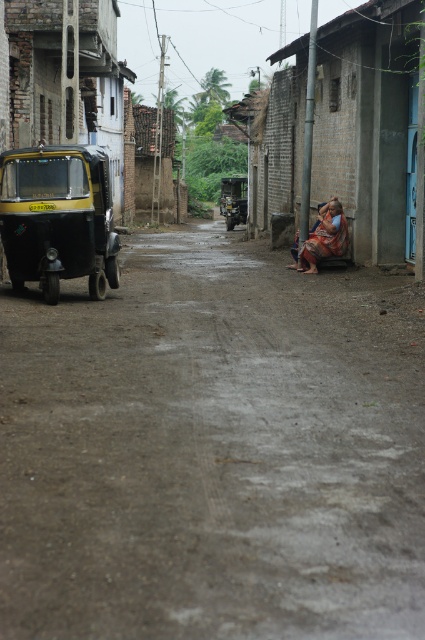
Question: Is yellow matte auto-rickshaw at left closer to camera compared to yellow-green plastic auto-rickshaw at left?

Choices:
 (A) yes
 (B) no

Answer: (A)

Question: Is orange fabric bench at right behind yellow matte auto-rickshaw at left?

Choices:
 (A) yes
 (B) no

Answer: (A)

Question: Which object appears farthest from the camera in this image?

Choices:
 (A) yellow matte auto-rickshaw at left
 (B) smooth concrete road at center

Answer: (A)

Question: Does orange fabric bench at right have a lesser width compared to yellow matte auto-rickshaw at left?

Choices:
 (A) yes
 (B) no

Answer: (B)

Question: Which object is the closest to the smooth concrete road at center?

Choices:
 (A) yellow-green plastic auto-rickshaw at left
 (B) yellow matte auto-rickshaw at left
 (C) orange fabric cloth at center

Answer: (B)

Question: Which point appears farthest from the camera in this image?

Choices:
 (A) (28, 145)
 (B) (11, 208)

Answer: (A)